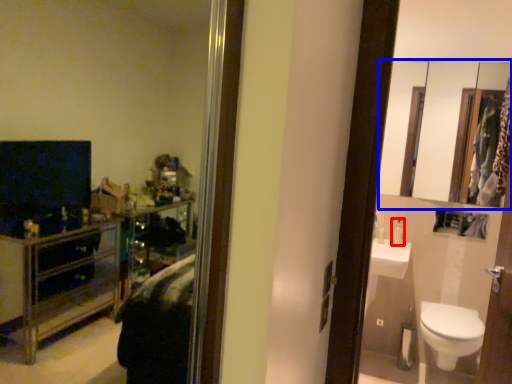
Question: Among these objects, which one is nearest to the camera, toiletry (highlighted by a red box) or mirror (highlighted by a blue box)?

Choices:
 (A) toiletry
 (B) mirror

Answer: (B)